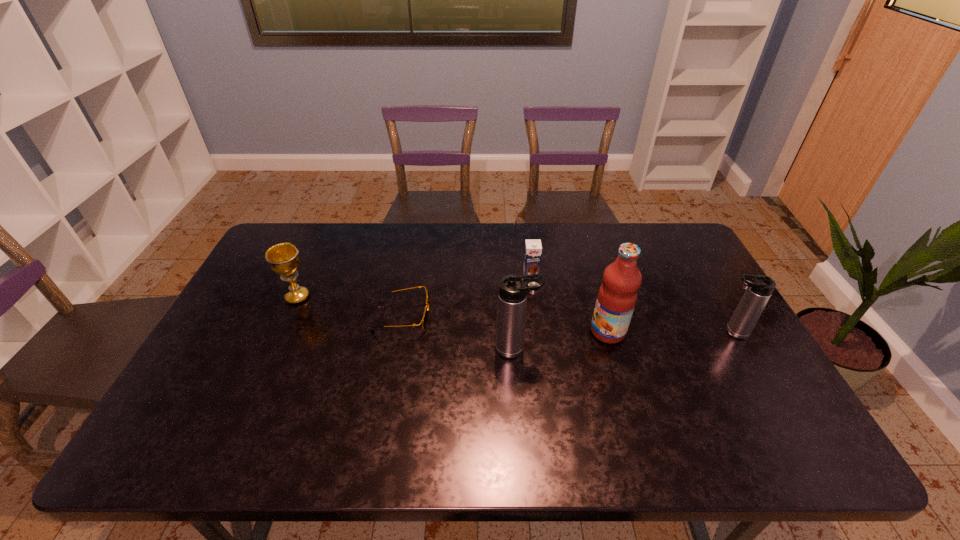
The width and height of the screenshot is (960, 540). What are the coordinates of `vacant area that lies between the left thermos bottle and the chalice` in the screenshot? It's located at (407, 323).

This screenshot has height=540, width=960. In order to click on free space between the sunglasses and the chocolate milk in this screenshot , I will do `click(467, 297)`.

At what (x,y) coordinates should I click in order to perform the action: click on unoccupied area between the farthest object and the sunglasses. Please return your answer as a coordinate pair (x, y). The width and height of the screenshot is (960, 540). Looking at the image, I should click on coord(467,297).

This screenshot has width=960, height=540. Find the location of `free space between the fruit juice and the taller thermos bottle`. free space between the fruit juice and the taller thermos bottle is located at coordinates (562, 340).

Identify which object is the third closest to the shortest object. Please provide its 2D coordinates. Your answer should be formatted as a tuple, i.e. [(x, y)], where the tuple contains the x and y coordinates of a point satisfying the conditions above.

[(533, 249)]

The width and height of the screenshot is (960, 540). In order to click on object that is the closest to the chalice in this screenshot , I will do `click(425, 318)`.

Locate an element on the screen. The height and width of the screenshot is (540, 960). vacant area in the image that satisfies the following two spatial constraints: 1. on the front label of the second shortest object; 2. on the handle side of the taller thermos bottle is located at coordinates (540, 349).